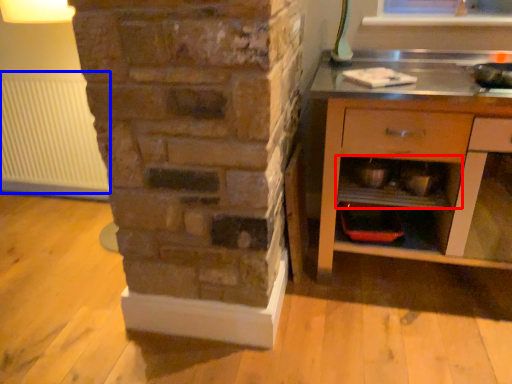
Question: Which object is further to the camera taking this photo, shelf (highlighted by a red box) or radiator (highlighted by a blue box)?

Choices:
 (A) shelf
 (B) radiator

Answer: (B)